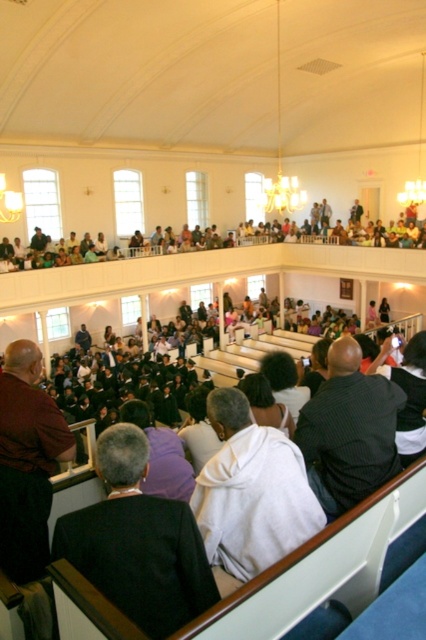
Question: Where is black fabric suit at lower left located in relation to white hoodie at center in the image?

Choices:
 (A) above
 (B) below

Answer: (B)

Question: Does white hoodie at center have a larger size compared to dark striped shirt at center?

Choices:
 (A) no
 (B) yes

Answer: (B)

Question: Which object is positioned closest to the dark striped shirt at center?

Choices:
 (A) black fabric suit at lower left
 (B) white hoodie at center

Answer: (B)

Question: Which is farther from the dark striped shirt at center?

Choices:
 (A) black fabric suit at lower left
 (B) white hoodie at center

Answer: (A)

Question: Which of the following is the closest to the observer?

Choices:
 (A) white hoodie at center
 (B) dark striped shirt at center
 (C) black fabric suit at lower left

Answer: (C)

Question: Is black fabric suit at lower left to the left of dark striped shirt at center from the viewer's perspective?

Choices:
 (A) no
 (B) yes

Answer: (B)